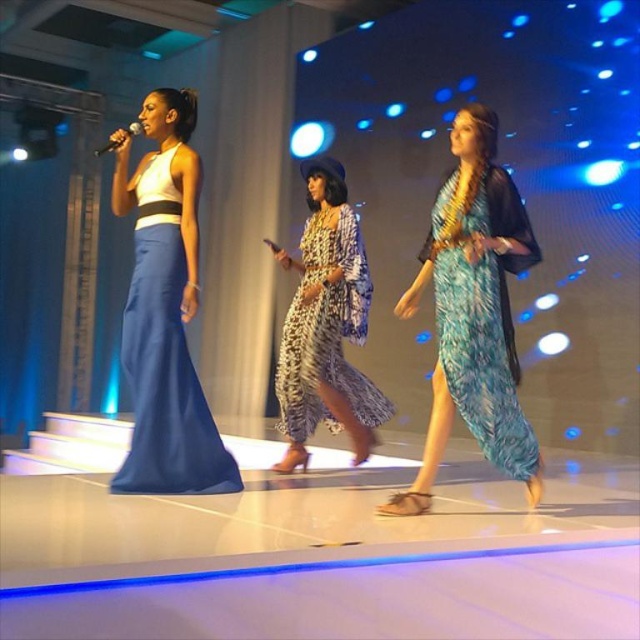
Question: In this image, where is blue feathered dress at center located relative to printed fabric dress at center?

Choices:
 (A) above
 (B) below

Answer: (A)

Question: Which is farther from the matte blue dress at left?

Choices:
 (A) printed fabric dress at center
 (B) blue feathered dress at center

Answer: (B)

Question: Which is farther from the blue feathered dress at center?

Choices:
 (A) black matte microphone at upper left
 (B) matte blue dress at left

Answer: (A)

Question: Can you confirm if blue feathered dress at center is positioned below black matte microphone at upper left?

Choices:
 (A) yes
 (B) no

Answer: (A)

Question: Can you confirm if blue feathered dress at center is thinner than printed fabric dress at center?

Choices:
 (A) yes
 (B) no

Answer: (A)

Question: Which point is closer to the camera?

Choices:
 (A) matte blue dress at left
 (B) blue feathered dress at center
 (C) printed fabric dress at center
 (D) black matte microphone at upper left

Answer: (B)